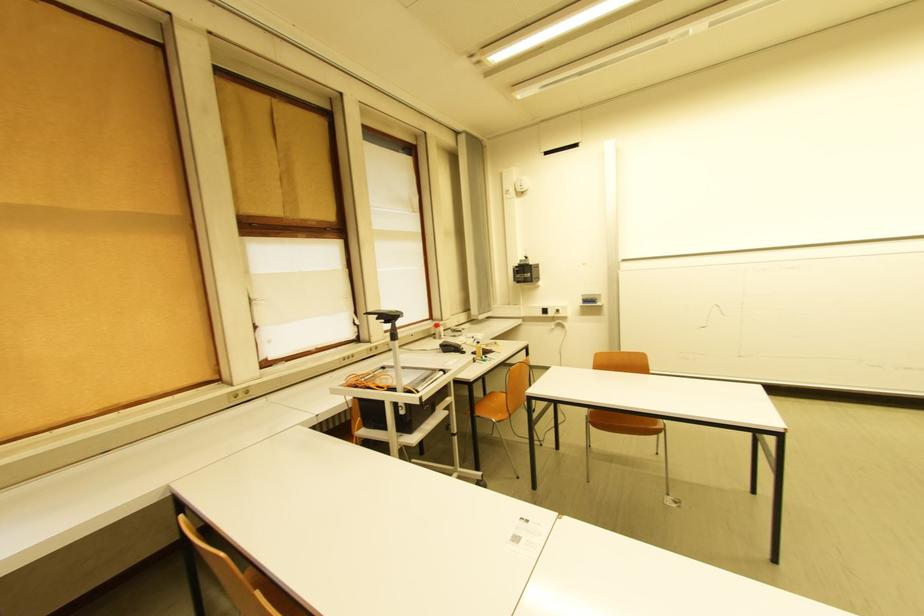
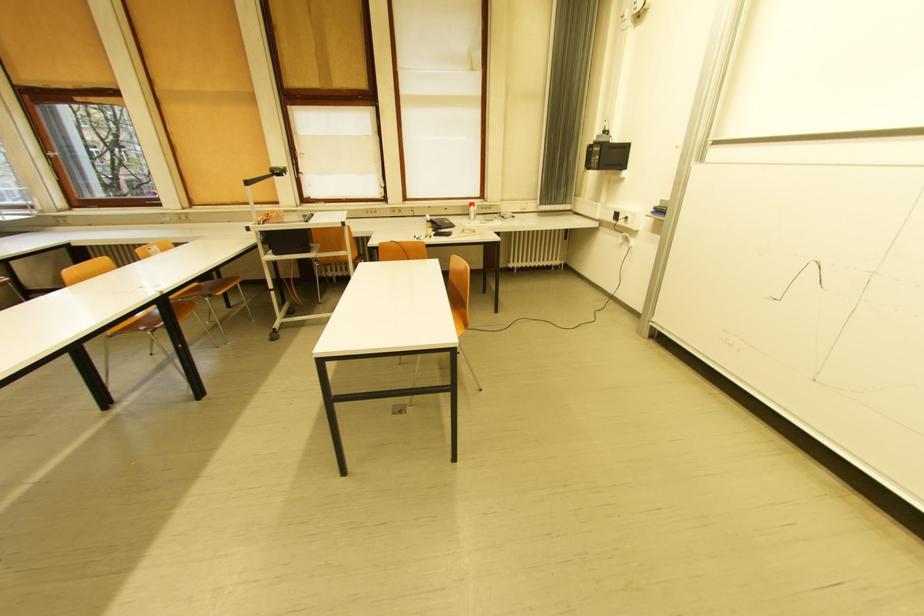
The point at (521, 283) is marked in the first image. Where is the corresponding point in the second image?

(592, 168)